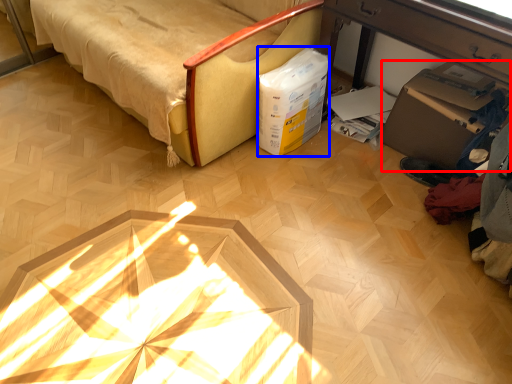
Question: Among these objects, which one is nearest to the camera, cardboard box (highlighted by a red box) or box (highlighted by a blue box)?

Choices:
 (A) cardboard box
 (B) box

Answer: (A)